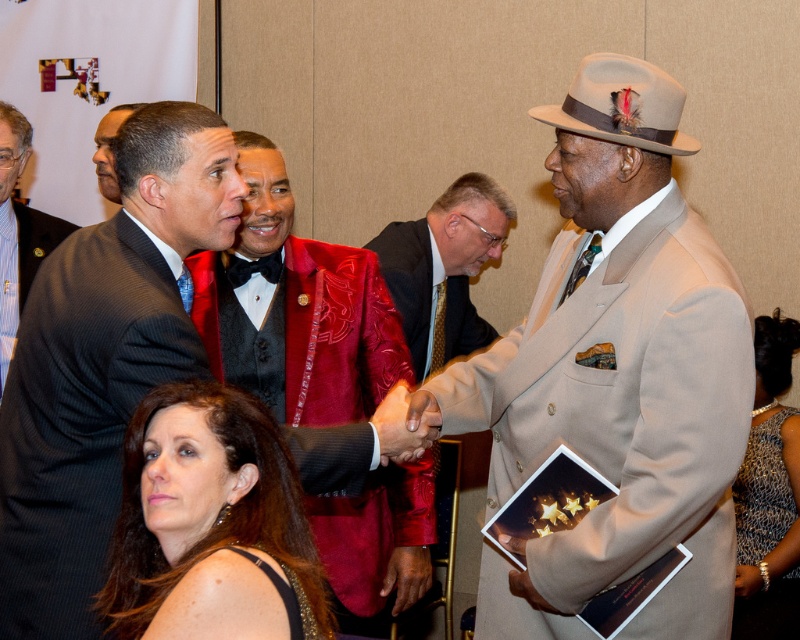
Between point (521, 352) and point (108, 116), which one is positioned behind?

The point (108, 116) is behind.

Does point (630, 632) come farther from viewer compared to point (102, 182)?

That is False.

Where is `beige wool suit at center`? beige wool suit at center is located at coordinates (616, 374).

At what (x,y) coordinates should I click in order to perform the action: click on brown hair at lower left. Please return your answer as a coordinate pair (x, y). This screenshot has height=640, width=800. Looking at the image, I should click on (210, 508).

Can you confirm if brown hair at lower left is positioned below sparkly silver dress at lower right?

No.

Which is behind, point (329, 625) or point (766, 419)?

Point (766, 419)

Image resolution: width=800 pixels, height=640 pixels. Find the location of `brown hair at lower left`. brown hair at lower left is located at coordinates (210, 508).

Does beige wool suit at center appear on the right side of shiny red jacket at center?

Indeed, beige wool suit at center is positioned on the right side of shiny red jacket at center.

Can you confirm if beige wool suit at center is thinner than shiny red jacket at center?

No.

Measure the distance between beige wool suit at center and camera.

The distance of beige wool suit at center from camera is 1.67 meters.

This screenshot has height=640, width=800. Find the location of `beige wool suit at center`. beige wool suit at center is located at coordinates (616, 374).